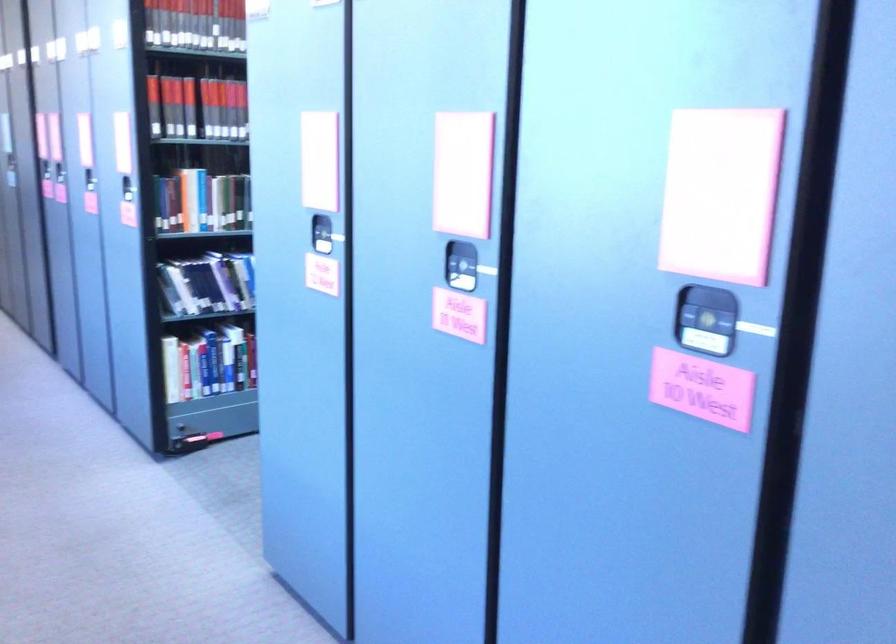
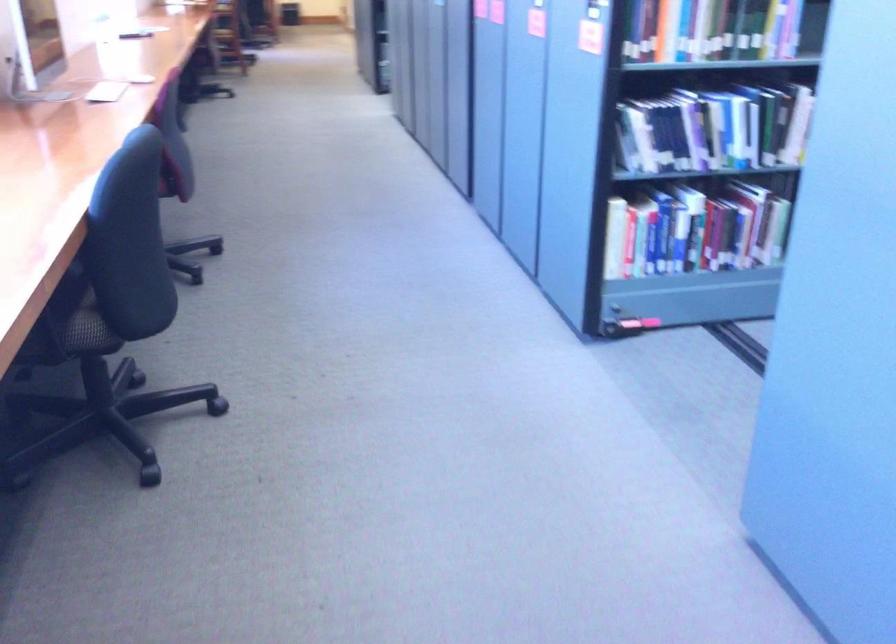
Where in the second image is the point corresponding to point 225,279 from the first image?

(695, 129)